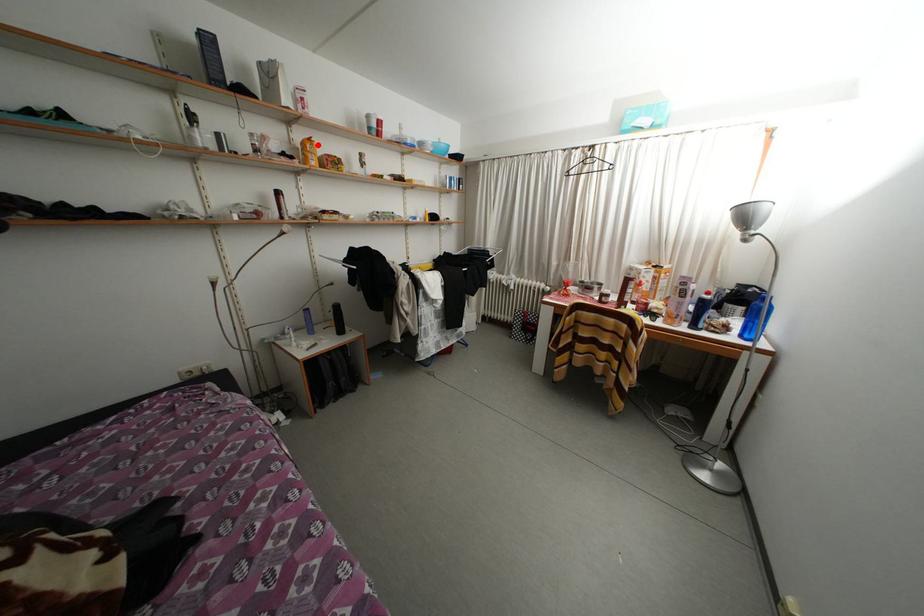
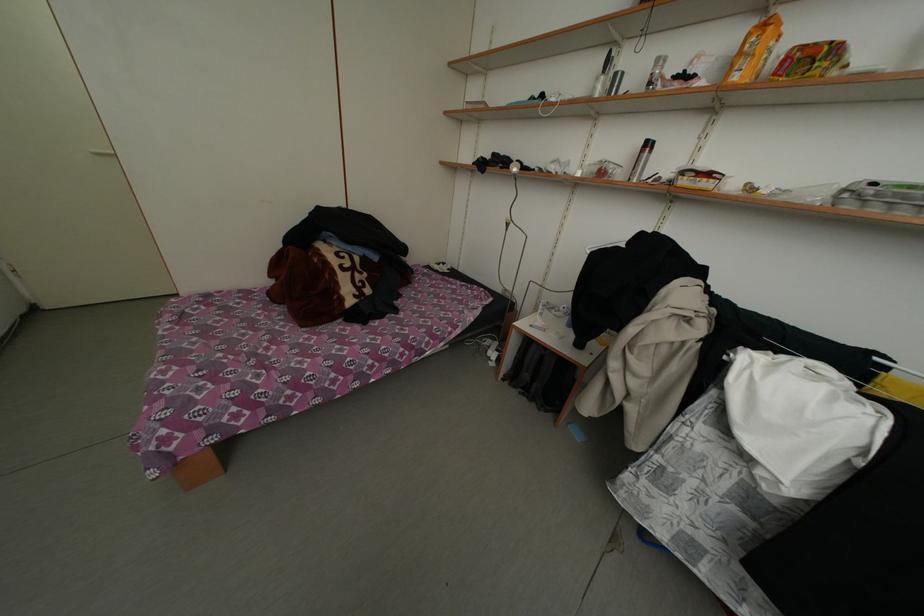
Question: I am providing you with two images of the same scene from different viewpoints. Image1 has a red point marked. In image2, the corresponding 3D location appears at what relative position? Reply with the corresponding letter.

Choices:
 (A) Closer
 (B) Farther

Answer: (B)